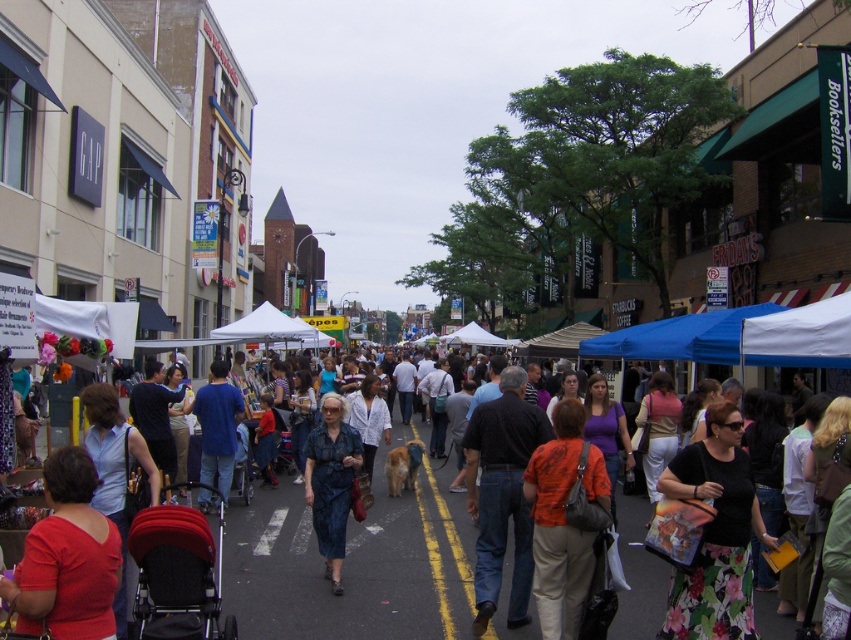
Does floral skirt at center have a greater height compared to matte red blouse at center?

Indeed, floral skirt at center has a greater height compared to matte red blouse at center.

Can you confirm if floral skirt at center is positioned below matte red blouse at center?

Indeed, floral skirt at center is positioned under matte red blouse at center.

Is point (715, 532) in front of point (84, 461)?

No, (715, 532) is further to viewer.

You are a GUI agent. You are given a task and a screenshot of the screen. Output one action in this format:
    pyautogui.click(x=<x>, y=<y>)
    Task: Click on the floral skirt at center
    
    Given the screenshot: What is the action you would take?
    pyautogui.click(x=715, y=532)

Does red fabric stroller at lower left have a lesser height compared to blue cotton shirt at center?

Incorrect, red fabric stroller at lower left's height does not fall short of blue cotton shirt at center's.

Can you confirm if red fabric stroller at lower left is positioned below blue cotton shirt at center?

Yes.

The height and width of the screenshot is (640, 851). I want to click on red fabric stroller at lower left, so click(178, 572).

The height and width of the screenshot is (640, 851). In order to click on red fabric stroller at lower left in this screenshot , I will do `click(178, 572)`.

Does matte black stroller at center appear under matte red blouse at center?

Yes.

Is matte black stroller at center closer to the viewer compared to matte red blouse at center?

No, matte black stroller at center is further to the viewer.

Measure the distance between point (253, 538) and camera.

Point (253, 538) is 9.59 meters from camera.

Identify the location of matte black stroller at center. (353, 563).